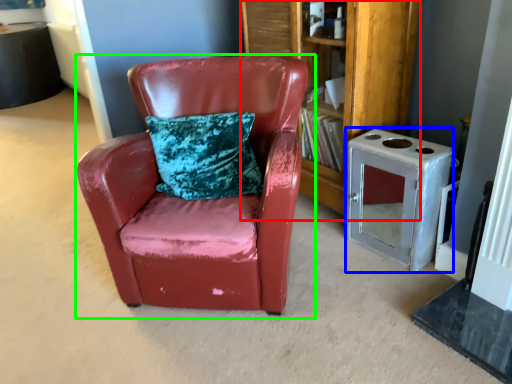
Question: Which is nearer to the bookshelf (highlighted by a red box)? appliance (highlighted by a blue box) or chair (highlighted by a green box).

Choices:
 (A) appliance
 (B) chair

Answer: (A)